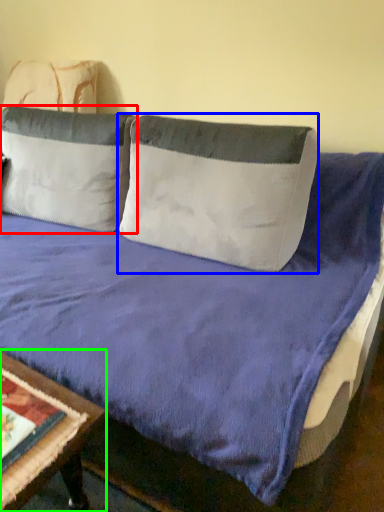
Question: Which object is positioned farthest from pillow (highlighted by a red box)? Select from pillow (highlighted by a blue box) and table (highlighted by a green box).

Choices:
 (A) pillow
 (B) table

Answer: (B)